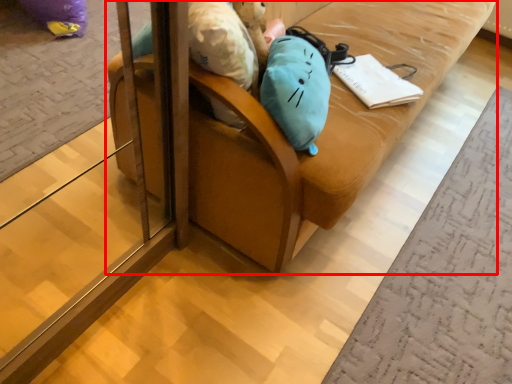
Question: From the image's perspective, what is the correct spatial positioning of furniture (annotated by the red box) in reference to notebook?

Choices:
 (A) above
 (B) below

Answer: (A)